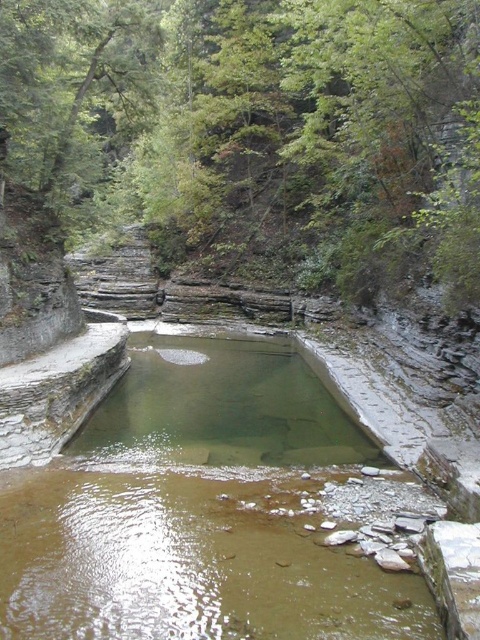
Consider the image. Between green leafy tree at upper center and clear stone pool at center, which one has less height?

With less height is clear stone pool at center.

Who is taller, green leafy tree at upper center or clear stone pool at center?

Standing taller between the two is green leafy tree at upper center.

Is point (408, 250) more distant than point (367, 604)?

Yes.

Find the location of a particular element. The height and width of the screenshot is (640, 480). green leafy tree at upper center is located at coordinates (257, 131).